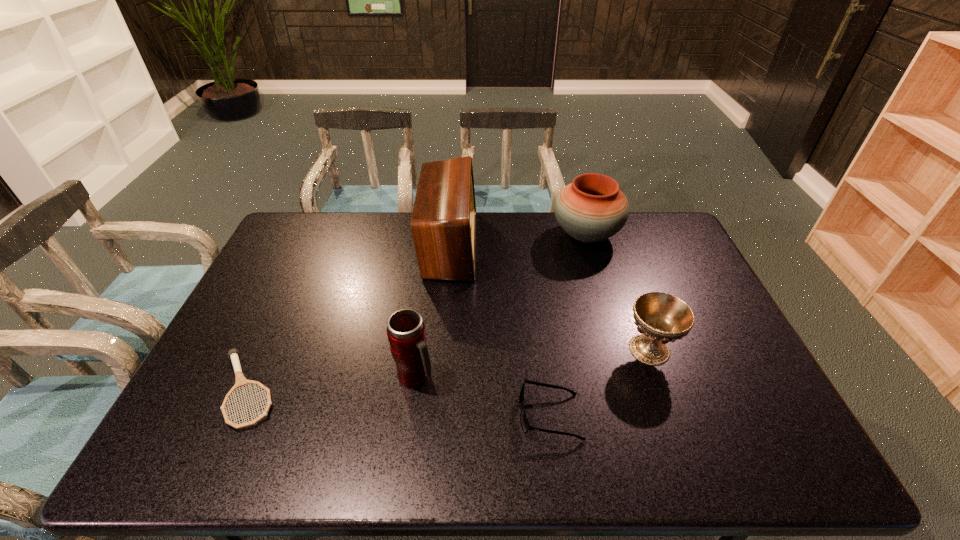
Find the location of a particular element. The height and width of the screenshot is (540, 960). free region at the far edge of the desktop is located at coordinates (358, 242).

Find the location of a particular element. This screenshot has height=540, width=960. vacant area at the near edge is located at coordinates (285, 451).

The height and width of the screenshot is (540, 960). I want to click on free location at the left edge of the desktop, so click(x=222, y=372).

Where is `vacant area at the right edge of the desktop`? The image size is (960, 540). vacant area at the right edge of the desktop is located at coordinates (718, 364).

The image size is (960, 540). In order to click on empty space between the radio receiver and the thermos bottle in this screenshot , I will do `click(433, 311)`.

At what (x,y) coordinates should I click in order to perform the action: click on free space between the thermos bottle and the radio receiver. Please return your answer as a coordinate pair (x, y). Image resolution: width=960 pixels, height=540 pixels. Looking at the image, I should click on (433, 311).

Locate an element on the screen. This screenshot has width=960, height=540. free space between the thermos bottle and the tennis racket is located at coordinates (331, 383).

Identify the location of vacant space in between the sunglasses and the pottery. (568, 325).

Identify the location of vacant area that lies between the tennis racket and the radio receiver. Image resolution: width=960 pixels, height=540 pixels. (348, 318).

Find the location of a particular element. vacant region between the chalice and the leftmost object is located at coordinates (448, 369).